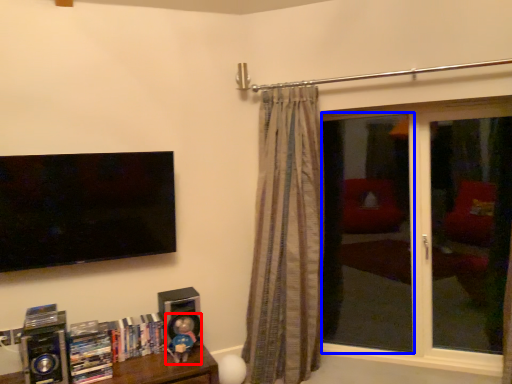
Question: Which of the following is the closest to the observer, toy (highlighted by a red box) or screen door (highlighted by a blue box)?

Choices:
 (A) toy
 (B) screen door

Answer: (A)